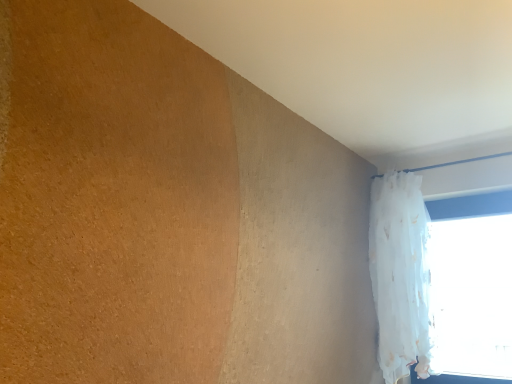
The width and height of the screenshot is (512, 384). I want to click on white sheer curtain at upper right, so click(x=401, y=275).

What do you see at coordinates (401, 275) in the screenshot?
I see `white sheer curtain at upper right` at bounding box center [401, 275].

What is the approximate width of white sheer curtain at upper right?

13.48 inches.

The image size is (512, 384). Describe the element at coordinates (468, 284) in the screenshot. I see `white sheer curtain at right` at that location.

Where is `white sheer curtain at right`? white sheer curtain at right is located at coordinates (468, 284).

This screenshot has width=512, height=384. In order to click on white sheer curtain at upper right in this screenshot , I will do `click(401, 275)`.

Is white sheer curtain at right at the left side of white sheer curtain at upper right?

No, white sheer curtain at right is not to the left of white sheer curtain at upper right.

Considering their positions, is white sheer curtain at right located in front of or behind white sheer curtain at upper right?

Visually, white sheer curtain at right is located behind white sheer curtain at upper right.

Is point (488, 277) closer or farther from the camera than point (413, 328)?

Point (488, 277).

From the picture: From the image's perspective, is white sheer curtain at right over white sheer curtain at upper right?

No, from the image's perspective, white sheer curtain at right is not over white sheer curtain at upper right.

From a real-world perspective, which is physically above, white sheer curtain at right or white sheer curtain at upper right?

In real-world perspective, white sheer curtain at upper right is above.

Considering the relative sizes of white sheer curtain at right and white sheer curtain at upper right in the image provided, is white sheer curtain at right wider than white sheer curtain at upper right?

No, white sheer curtain at right is not wider than white sheer curtain at upper right.

Who is taller, white sheer curtain at right or white sheer curtain at upper right?

white sheer curtain at upper right is taller.

Based on the photo, considering the sizes of objects white sheer curtain at right and white sheer curtain at upper right in the image provided, who is smaller, white sheer curtain at right or white sheer curtain at upper right?

Smaller between the two is white sheer curtain at right.

Is white sheer curtain at right situated inside white sheer curtain at upper right or outside?

white sheer curtain at right is spatially situated outside white sheer curtain at upper right.

Are white sheer curtain at right and white sheer curtain at upper right making contact?

white sheer curtain at right is not next to white sheer curtain at upper right, and they're not touching.

Is white sheer curtain at right facing away from white sheer curtain at upper right?

Yes, white sheer curtain at upper right is at the back of white sheer curtain at right.

Measure the distance from white sheer curtain at right to white sheer curtain at upper right.

7.16 inches.

In the image, there is a white sheer curtain at upper right. Where is `window below it (from the image's perspective)`? This screenshot has height=384, width=512. window below it (from the image's perspective) is located at coordinates (468, 284).

Consider the image. Between white sheer curtain at upper right and white sheer curtain at right, which one appears on the right side from the viewer's perspective?

Positioned to the right is white sheer curtain at right.

Is white sheer curtain at upper right behind white sheer curtain at right?

No, white sheer curtain at upper right is closer to the camera.

Which is behind, point (411, 270) or point (499, 215)?

The point (499, 215) is behind.

From the image's perspective, which one is positioned higher, white sheer curtain at upper right or white sheer curtain at right?

white sheer curtain at upper right is shown above in the image.

From a real-world perspective, is white sheer curtain at upper right positioned over white sheer curtain at right based on gravity?

Yes, from a real-world perspective, white sheer curtain at upper right is on top of white sheer curtain at right.

Which of these two, white sheer curtain at upper right or white sheer curtain at right, is wider?

With larger width is white sheer curtain at upper right.

Is white sheer curtain at upper right shorter than white sheer curtain at right?

In fact, white sheer curtain at upper right may be taller than white sheer curtain at right.

Between white sheer curtain at upper right and white sheer curtain at right, which one has smaller size?

white sheer curtain at right is smaller.

Is white sheer curtain at upper right outside of white sheer curtain at right?

Yes, white sheer curtain at upper right is located beyond the bounds of white sheer curtain at right.

Is white sheer curtain at upper right placed right next to white sheer curtain at right?

They are not placed beside each other.

Is white sheer curtain at upper right oriented away from white sheer curtain at right?

Yes, white sheer curtain at right is at the back of white sheer curtain at upper right.

Identify the location of window located on the right of white sheer curtain at upper right. Image resolution: width=512 pixels, height=384 pixels. (468, 284).

In order to click on window behind the white sheer curtain at upper right in this screenshot , I will do `click(468, 284)`.

Locate an element on the screen. The width and height of the screenshot is (512, 384). window that is below the white sheer curtain at upper right (from the image's perspective) is located at coordinates (468, 284).